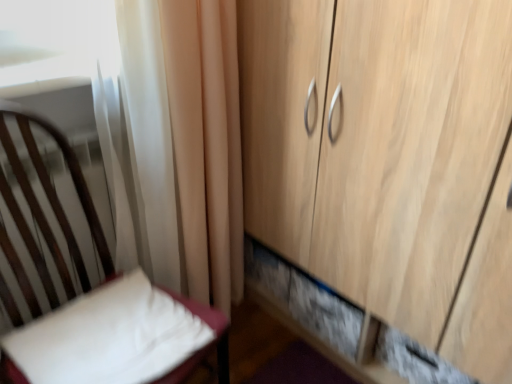
You are a GUI agent. You are given a task and a screenshot of the screen. Output one action in this format:
    pyautogui.click(x=<x>, y=<y>)
    Task: Click on the vacant area on top of white soft pillow at lower left (from a real-world perspective)
    
    Given the screenshot: What is the action you would take?
    pyautogui.click(x=106, y=335)